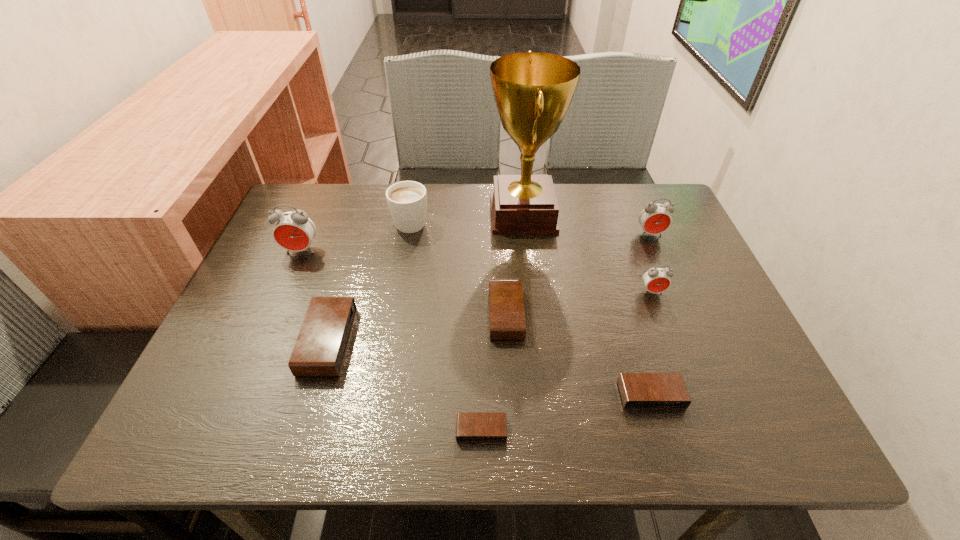
At what (x,y) coordinates should I click in order to perform the action: click on the tallest object. Please return your answer as a coordinate pair (x, y). Image resolution: width=960 pixels, height=540 pixels. Looking at the image, I should click on (533, 91).

You are a GUI agent. You are given a task and a screenshot of the screen. Output one action in this format:
    pyautogui.click(x=<x>, y=<y>)
    Task: Click on the gold award
    This screenshot has height=540, width=960.
    Given the screenshot: What is the action you would take?
    pyautogui.click(x=533, y=91)

At what (x,y) coordinates should I click in order to perform the action: click on the second nearest red alarm clock. Please return your answer as a coordinate pair (x, y). The image size is (960, 540). Looking at the image, I should click on (294, 231).

The width and height of the screenshot is (960, 540). Identify the location of the tallest alarm clock. (294, 231).

The image size is (960, 540). Identify the location of the farthest alarm clock. (654, 218).

Where is `the farthest red alarm clock`? The width and height of the screenshot is (960, 540). the farthest red alarm clock is located at coordinates (654, 218).

Locate an element on the screen. white cappuccino is located at coordinates (407, 200).

What are the coordinates of `cappuccino` in the screenshot? It's located at (407, 200).

Locate an element on the screen. The image size is (960, 540). the smallest red alarm clock is located at coordinates (656, 280).

Image resolution: width=960 pixels, height=540 pixels. Identify the location of the fifth tallest object. (656, 280).